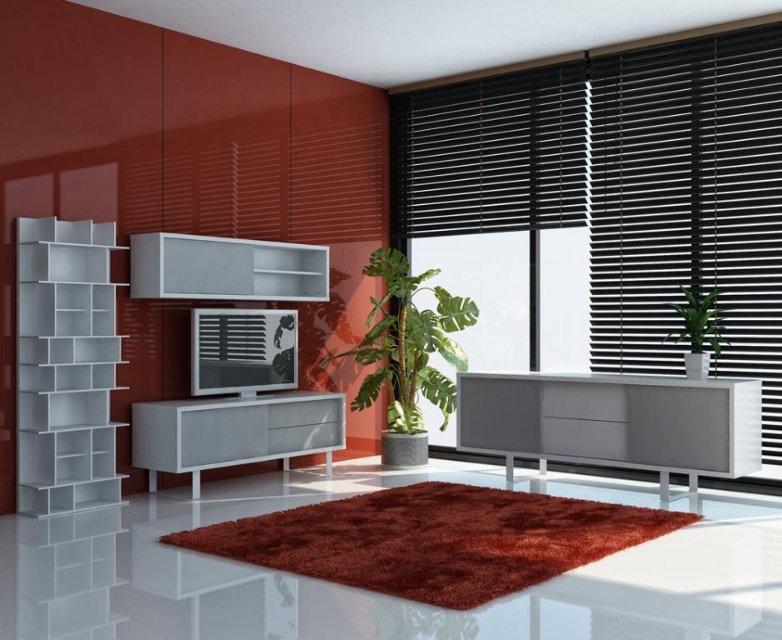
Does white matte bookshelf at left have a lesser height compared to white glossy shelf at center?

No, white matte bookshelf at left is not shorter than white glossy shelf at center.

What do you see at coordinates (65, 365) in the screenshot? I see `white matte bookshelf at left` at bounding box center [65, 365].

This screenshot has height=640, width=782. In order to click on white matte bookshelf at left in this screenshot , I will do `click(65, 365)`.

Between point (515, 188) and point (386, 422), which one is positioned in front?

Positioned in front is point (515, 188).

This screenshot has height=640, width=782. What do you see at coordinates (622, 186) in the screenshot?
I see `black matte blinds at right` at bounding box center [622, 186].

I want to click on black matte blinds at right, so click(x=622, y=186).

You are a GUI agent. You are given a task and a screenshot of the screen. Output one action in this format:
    pyautogui.click(x=<x>, y=<y>)
    Task: Click on the matte white entertainment center at center
    Image resolution: width=782 pixels, height=640 pixels.
    Given the screenshot: What is the action you would take?
    pyautogui.click(x=230, y=426)

Can you confirm if matte white entertainment center at center is thinner than white glossy shelf at center?

In fact, matte white entertainment center at center might be wider than white glossy shelf at center.

Which is behind, point (149, 444) or point (128, 262)?

Point (128, 262)

Find the location of a particular element. This screenshot has height=640, width=782. matte white entertainment center at center is located at coordinates (230, 426).